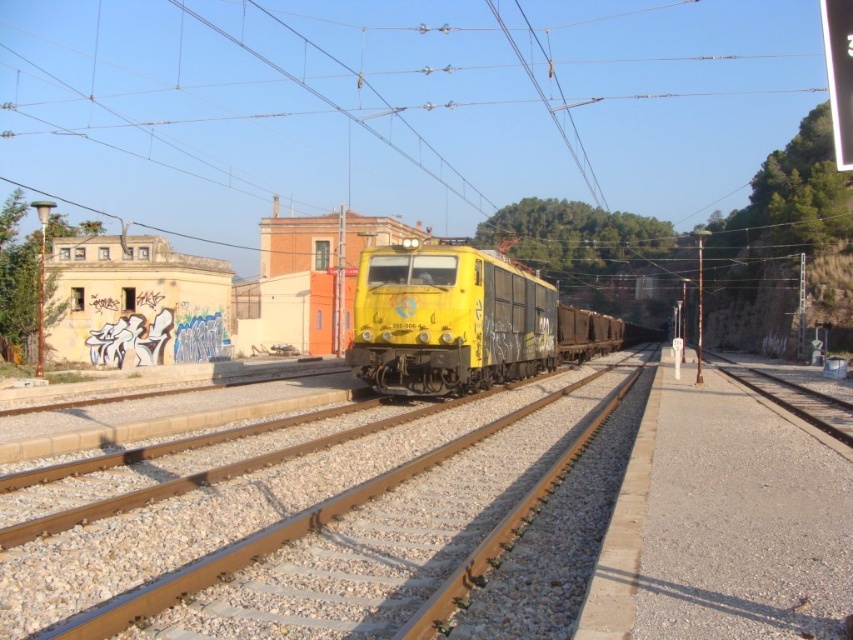
Consider the image. You are a railway engineer inspecting the tracks. You notice two trains, the yellow metal train at center and the yellow matte train at center. Which one is located to the left?

The yellow metal train at center is positioned on the left side of the yellow matte train at center, so the yellow metal train at center is located to the left.

You are a photographer standing at the railway tracks and see the yellow metal train at center and the yellow matte train at center. Which train is positioned lower in the image?

The yellow metal train at center is located below the yellow matte train at center, so it is positioned lower in the image.

You are standing on the railway tracks and see two trains, the yellow metal train at center and the yellow matte train at center. Which one appears nearer to you?

The yellow metal train at center appears nearer to you because it is closer to the viewer than the yellow matte train at center.